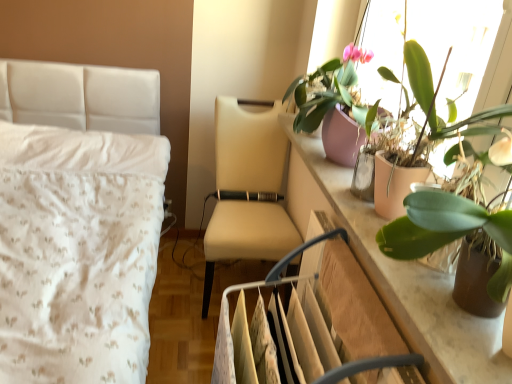
What do you see at coordinates (452, 241) in the screenshot?
I see `green matte leafy plant at upper right, acting as the second houseplant starting from the front` at bounding box center [452, 241].

In order to face green matte leafy plant at upper right, acting as the second houseplant starting from the front, should I rotate leftwards or rightwards?

It's best to rotate right around 25.540 degrees.

What do you see at coordinates (448, 232) in the screenshot?
I see `green matte plant at upper right, arranged as the first houseplant when viewed from the front` at bounding box center [448, 232].

You are a GUI agent. You are given a task and a screenshot of the screen. Output one action in this format:
    pyautogui.click(x=<x>, y=<y>)
    Task: Click on the green matte leafy plant at upper right, acting as the second houseplant starting from the front
    This screenshot has width=512, height=384.
    Given the screenshot: What is the action you would take?
    pyautogui.click(x=452, y=241)

From a real-world perspective, which houseplant is the 1st one above the green matte leafy plant at upper right, acting as the second houseplant starting from the front? Please provide its 2D coordinates.

[(332, 93)]

In the scene shown: Which object is further away from the camera, green matte leafy plant at upper right, the second houseplant viewed from the back, or pink matte pot at upper right, which is counted as the 3th houseplant, starting from the front?

pink matte pot at upper right, which is counted as the 3th houseplant, starting from the front, is further from the camera.

Which is closer, [507,237] or [318,104]?

Point [507,237] is positioned closer to the camera compared to point [318,104].

Which of these two, green matte leafy plant at upper right, the second houseplant viewed from the back, or pink matte pot at upper right, the first houseplant in the back-to-front sequence, is smaller?

With smaller size is green matte leafy plant at upper right, the second houseplant viewed from the back.

In the scene shown: Which object is positioned more to the right, beige leather swivel chair at center or beige fabric chair at center?

From the viewer's perspective, beige leather swivel chair at center appears more on the right side.

Locate an element on the screen. This screenshot has height=384, width=512. chair above the beige leather swivel chair at center (from a real-world perspective) is located at coordinates (247, 190).

Which of these two, green matte leafy plant at upper right, the second houseplant viewed from the back, or beige fabric chair at center, is smaller?

With smaller size is green matte leafy plant at upper right, the second houseplant viewed from the back.

From the image's perspective, is green matte leafy plant at upper right, acting as the second houseplant starting from the front, located above or below beige fabric chair at center?

Based on their image positions, green matte leafy plant at upper right, acting as the second houseplant starting from the front, is located above beige fabric chair at center.

Considering the relative positions of green matte leafy plant at upper right, the second houseplant viewed from the back, and beige fabric chair at center in the image provided, is green matte leafy plant at upper right, the second houseplant viewed from the back, to the left of beige fabric chair at center from the viewer's perspective?

No, green matte leafy plant at upper right, the second houseplant viewed from the back, is not to the left of beige fabric chair at center.

Where is `chair on the left side of green matte leafy plant at upper right, acting as the second houseplant starting from the front`? This screenshot has height=384, width=512. chair on the left side of green matte leafy plant at upper right, acting as the second houseplant starting from the front is located at coordinates (247, 190).

Does point (285, 96) come behind point (285, 223)?

That is True.

What's the angular difference between pink matte pot at upper right, the first houseplant in the back-to-front sequence, and beige fabric chair at center's facing directions?

87.9 degrees separate the facing orientations of pink matte pot at upper right, the first houseplant in the back-to-front sequence, and beige fabric chair at center.

From a real-world perspective, between pink matte pot at upper right, the first houseplant in the back-to-front sequence, and beige fabric chair at center, who is vertically higher?

In real-world perspective, pink matte pot at upper right, the first houseplant in the back-to-front sequence, is above.

Is pink matte pot at upper right, which is counted as the 3th houseplant, starting from the front, wider than beige fabric chair at center?

Incorrect, the width of pink matte pot at upper right, which is counted as the 3th houseplant, starting from the front, does not surpass that of beige fabric chair at center.

Is beige leather swivel chair at center smaller than green matte plant at upper right, marked as the 3th houseplant in a back-to-front arrangement?

Actually, beige leather swivel chair at center might be larger than green matte plant at upper right, marked as the 3th houseplant in a back-to-front arrangement.

What's the angular difference between beige leather swivel chair at center and green matte plant at upper right, marked as the 3th houseplant in a back-to-front arrangement,'s facing directions?

The angle between the facing direction of beige leather swivel chair at center and the facing direction of green matte plant at upper right, marked as the 3th houseplant in a back-to-front arrangement, is 0.0872 degrees.

Would you say green matte plant at upper right, marked as the 3th houseplant in a back-to-front arrangement, is part of beige leather swivel chair at center's contents?

No, green matte plant at upper right, marked as the 3th houseplant in a back-to-front arrangement, is not a part of beige leather swivel chair at center.

Is the depth of beige leather swivel chair at center greater than that of green matte plant at upper right, marked as the 3th houseplant in a back-to-front arrangement?

Yes, the depth of beige leather swivel chair at center is greater than that of green matte plant at upper right, marked as the 3th houseplant in a back-to-front arrangement.

From the image's perspective, which one is positioned lower, green matte plant at upper right, marked as the 3th houseplant in a back-to-front arrangement, or pink matte pot at upper right, which is counted as the 3th houseplant, starting from the front?

green matte plant at upper right, marked as the 3th houseplant in a back-to-front arrangement, is shown below in the image.

Which of these two, green matte plant at upper right, marked as the 3th houseplant in a back-to-front arrangement, or pink matte pot at upper right, which is counted as the 3th houseplant, starting from the front, is thinner?

green matte plant at upper right, marked as the 3th houseplant in a back-to-front arrangement, is thinner.

Who is more distant, green matte plant at upper right, arranged as the first houseplant when viewed from the front, or pink matte pot at upper right, which is counted as the 3th houseplant, starting from the front?

pink matte pot at upper right, which is counted as the 3th houseplant, starting from the front, is further away from the camera.

What's the angular difference between green matte plant at upper right, arranged as the first houseplant when viewed from the front, and pink matte pot at upper right, the first houseplant in the back-to-front sequence,'s facing directions?

green matte plant at upper right, arranged as the first houseplant when viewed from the front, and pink matte pot at upper right, the first houseplant in the back-to-front sequence, are facing 6.26e-05 degrees away from each other.

Could green matte leafy plant at upper right, the second houseplant viewed from the back, be considered to be inside green matte plant at upper right, marked as the 3th houseplant in a back-to-front arrangement?

Yes, green matte leafy plant at upper right, the second houseplant viewed from the back, is a part of green matte plant at upper right, marked as the 3th houseplant in a back-to-front arrangement.

Does green matte plant at upper right, marked as the 3th houseplant in a back-to-front arrangement, have a smaller size compared to green matte leafy plant at upper right, the second houseplant viewed from the back?

Actually, green matte plant at upper right, marked as the 3th houseplant in a back-to-front arrangement, might be larger than green matte leafy plant at upper right, the second houseplant viewed from the back.

From a real-world perspective, relative to green matte leafy plant at upper right, acting as the second houseplant starting from the front, is green matte plant at upper right, arranged as the first houseplant when viewed from the front, vertically above or below?

green matte plant at upper right, arranged as the first houseplant when viewed from the front, is above green matte leafy plant at upper right, acting as the second houseplant starting from the front.

How different are the orientations of green matte plant at upper right, arranged as the first houseplant when viewed from the front, and green matte leafy plant at upper right, the second houseplant viewed from the back, in degrees?

There is a 9.38e-05-degree angle between the facing directions of green matte plant at upper right, arranged as the first houseplant when viewed from the front, and green matte leafy plant at upper right, the second houseplant viewed from the back.

Identify the location of houseplant that is the 2nd object to the right of the pink matte pot at upper right, which is counted as the 3th houseplant, starting from the front, starting at the anchor. (452, 241).

The height and width of the screenshot is (384, 512). Find the location of `chair behind the beige leather swivel chair at center`. chair behind the beige leather swivel chair at center is located at coordinates click(x=247, y=190).

Looking at the image, which one is located further to green matte leafy plant at upper right, acting as the second houseplant starting from the front, green matte plant at upper right, marked as the 3th houseplant in a back-to-front arrangement, or pink matte pot at upper right, which is counted as the 3th houseplant, starting from the front?

pink matte pot at upper right, which is counted as the 3th houseplant, starting from the front, is positioned further to the anchor green matte leafy plant at upper right, acting as the second houseplant starting from the front.

Considering their positions, is beige leather swivel chair at center positioned further to beige fabric chair at center than green matte leafy plant at upper right, acting as the second houseplant starting from the front?

green matte leafy plant at upper right, acting as the second houseplant starting from the front, is further to beige fabric chair at center.

Estimate the real-world distances between objects in this image. Which object is closer to green matte plant at upper right, marked as the 3th houseplant in a back-to-front arrangement, pink matte pot at upper right, which is counted as the 3th houseplant, starting from the front, or beige leather swivel chair at center?

beige leather swivel chair at center is positioned closer to the anchor green matte plant at upper right, marked as the 3th houseplant in a back-to-front arrangement.

Which object lies further to the anchor point green matte plant at upper right, arranged as the first houseplant when viewed from the front, green matte leafy plant at upper right, the second houseplant viewed from the back, or beige leather swivel chair at center?

Among the two, beige leather swivel chair at center is located further to green matte plant at upper right, arranged as the first houseplant when viewed from the front.

Based on their spatial positions, is green matte plant at upper right, arranged as the first houseplant when viewed from the front, or pink matte pot at upper right, the first houseplant in the back-to-front sequence, further from beige leather swivel chair at center?

pink matte pot at upper right, the first houseplant in the back-to-front sequence, is further to beige leather swivel chair at center.

Looking at the image, which one is located further to green matte plant at upper right, arranged as the first houseplant when viewed from the front, pink matte pot at upper right, the first houseplant in the back-to-front sequence, or green matte leafy plant at upper right, the second houseplant viewed from the back?

pink matte pot at upper right, the first houseplant in the back-to-front sequence, is positioned further to the anchor green matte plant at upper right, arranged as the first houseplant when viewed from the front.

Looking at the image, which one is located closer to beige leather swivel chair at center, pink matte pot at upper right, which is counted as the 3th houseplant, starting from the front, or green matte plant at upper right, arranged as the first houseplant when viewed from the front?

Among the two, green matte plant at upper right, arranged as the first houseplant when viewed from the front, is located nearer to beige leather swivel chair at center.

Considering their positions, is beige fabric chair at center positioned further to green matte leafy plant at upper right, acting as the second houseplant starting from the front, than pink matte pot at upper right, which is counted as the 3th houseplant, starting from the front?

Based on the image, beige fabric chair at center appears to be further to green matte leafy plant at upper right, acting as the second houseplant starting from the front.

In order to click on houseplant between green matte plant at upper right, marked as the 3th houseplant in a back-to-front arrangement, and beige leather swivel chair at center, in the vertical direction in this screenshot , I will do `click(452, 241)`.

Locate an element on the screen. The height and width of the screenshot is (384, 512). swivel chair located between green matte leafy plant at upper right, acting as the second houseplant starting from the front, and beige fabric chair at center in the depth direction is located at coordinates [313, 331].

You are a GUI agent. You are given a task and a screenshot of the screen. Output one action in this format:
    pyautogui.click(x=<x>, y=<y>)
    Task: Click on the chair between pink matte pot at upper right, the first houseplant in the back-to-front sequence, and beige leather swivel chair at center, in the vertical direction
    The image size is (512, 384).
    Given the screenshot: What is the action you would take?
    pyautogui.click(x=247, y=190)

Where is `houseplant positioned between green matte plant at upper right, marked as the 3th houseplant in a back-to-front arrangement, and pink matte pot at upper right, which is counted as the 3th houseplant, starting from the front, from near to far`? houseplant positioned between green matte plant at upper right, marked as the 3th houseplant in a back-to-front arrangement, and pink matte pot at upper right, which is counted as the 3th houseplant, starting from the front, from near to far is located at coordinates (452, 241).